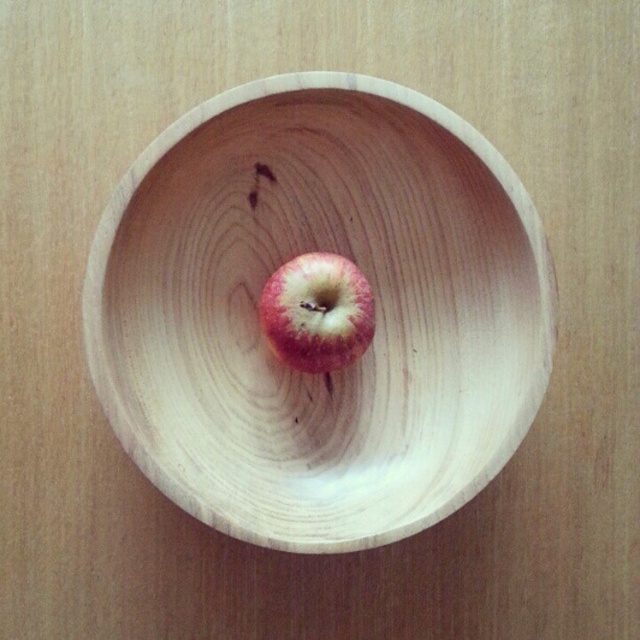
You are an artist setting up a still life. You have a natural wood bowl at center and a red matte apple at center. Which object should you place first if you want the smaller item to sit inside the larger one?

You should place the natural wood bowl at center first because it is larger than the red matte apple at center, allowing the apple to be placed inside it.

You are arranging fruits on a table and need to place the red matte apple at center into the natural wood bowl at center. Can you do this without moving the bowl?

The natural wood bowl at center is positioned under the red matte apple at center, so yes, you can place the red matte apple at center into the natural wood bowl at center without moving the bowl.